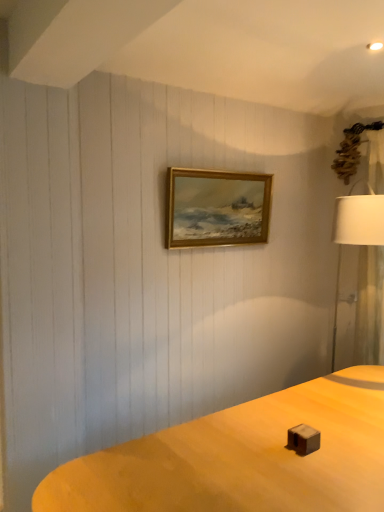
The height and width of the screenshot is (512, 384). In order to click on empty space that is ontop of gold wooden picture frame at center (from a real-world perspective) in this screenshot , I will do `click(216, 169)`.